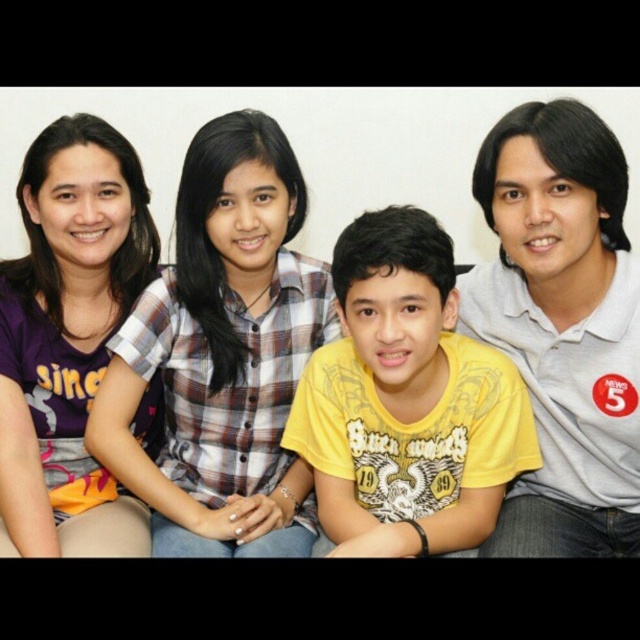
From the picture: Is plaid fabric shirt at center positioned before matte yellow t-shirt at center?

Yes, plaid fabric shirt at center is closer to the viewer.

Between point (285, 173) and point (310, 248), which one is positioned in front?

Point (285, 173) is more forward.

Does point (289, 156) come in front of point (545, 97)?

Yes, it is.

At what (x,y) coordinates should I click in order to perform the action: click on plaid fabric shirt at center. Please return your answer as a coordinate pair (x, y). This screenshot has height=640, width=640. Looking at the image, I should click on point(221,355).

Can you confirm if gray matte polo shirt at right is positioned to the left of purple matte shirt at upper left?

Incorrect, gray matte polo shirt at right is not on the left side of purple matte shirt at upper left.

Does gray matte polo shirt at right appear over purple matte shirt at upper left?

Incorrect, gray matte polo shirt at right is not positioned above purple matte shirt at upper left.

At what (x,y) coordinates should I click in order to perform the action: click on gray matte polo shirt at right. Please return your answer as a coordinate pair (x, y). The width and height of the screenshot is (640, 640). Looking at the image, I should click on (563, 326).

This screenshot has width=640, height=640. I want to click on gray matte polo shirt at right, so click(563, 326).

Between plaid fabric shirt at center and yellow matte shirt at center, which one appears on the right side from the viewer's perspective?

Positioned to the right is yellow matte shirt at center.

Who is taller, plaid fabric shirt at center or yellow matte shirt at center?

With more height is plaid fabric shirt at center.

Is point (291, 284) positioned in front of point (410, 403)?

That is False.

Locate an element on the screen. The width and height of the screenshot is (640, 640). plaid fabric shirt at center is located at coordinates (221, 355).